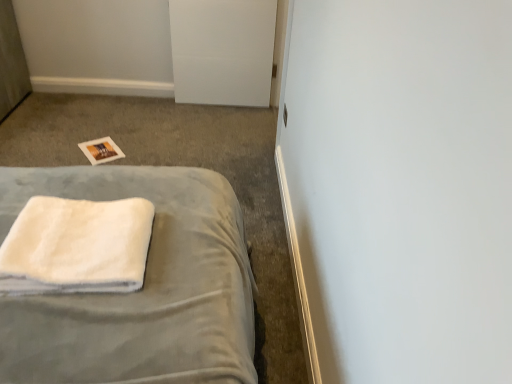
What is the approximate width of white fluffy towel at lower left?

13.58 inches.

The image size is (512, 384). What do you see at coordinates (223, 51) in the screenshot?
I see `white matte door at upper center` at bounding box center [223, 51].

Measure the distance between white matte door at upper center and camera.

They are 9.74 feet apart.

The image size is (512, 384). Find the location of `white fluffy towel at lower left`. white fluffy towel at lower left is located at coordinates point(76,246).

Considering the points (167, 250) and (55, 251), which point is behind, point (167, 250) or point (55, 251)?

Point (167, 250)

From a real-world perspective, is white soft towel at lower left physically located above or below white fluffy towel at lower left?

Clearly, from a real-world perspective, white soft towel at lower left is below white fluffy towel at lower left.

Is the position of white soft towel at lower left less distant than that of white fluffy towel at lower left?

No, white soft towel at lower left is behind white fluffy towel at lower left.

From the image's perspective, between white soft towel at lower left and white fluffy towel at lower left, which one is located above?

white soft towel at lower left is shown above in the image.

Considering the positions of point (227, 92) and point (141, 334), is point (227, 92) closer or farther from the camera than point (141, 334)?

Point (227, 92).

What's the angular difference between white matte door at upper center and white soft towel at lower left's facing directions?

2.91 degrees.

In the scene shown: Relative to white soft towel at lower left, is white matte door at upper center in front or behind?

white matte door at upper center is behind white soft towel at lower left.

From the image's perspective, is white soft towel at lower left above white matte door at upper center?

Incorrect, from the image's perspective, white soft towel at lower left is lower than white matte door at upper center.

Between white soft towel at lower left and white matte door at upper center, which one is positioned behind?

white matte door at upper center is behind.

Is white soft towel at lower left looking in the opposite direction of white matte door at upper center?

No, white matte door at upper center is not at the back of white soft towel at lower left.

You are a GUI agent. You are given a task and a screenshot of the screen. Output one action in this format:
    pyautogui.click(x=<x>, y=<y>)
    Task: Click on the bed that is on the left side of white matte door at upper center
    The height and width of the screenshot is (384, 512).
    Given the screenshot: What is the action you would take?
    pyautogui.click(x=142, y=288)

How distant is white fluffy towel at lower left from white matte door at upper center?

7.19 feet.

Does white fluffy towel at lower left turn towards white matte door at upper center?

Yes, white fluffy towel at lower left is facing white matte door at upper center.

In the image, is white fluffy towel at lower left positioned in front of or behind white matte door at upper center?

In the image, white fluffy towel at lower left appears in front of white matte door at upper center.

Considering the sizes of objects white fluffy towel at lower left and white matte door at upper center in the image provided, who is bigger, white fluffy towel at lower left or white matte door at upper center?

white matte door at upper center is bigger.

Which point is more forward, (x=218, y=47) or (x=52, y=274)?

The point (x=52, y=274) is closer.

From the image's perspective, between white matte door at upper center and white fluffy towel at lower left, which one is located above?

white matte door at upper center.

Is white matte door at upper center facing away from white fluffy towel at lower left?

That's not correct — white matte door at upper center is not looking away from white fluffy towel at lower left.

Is white matte door at upper center not near white fluffy towel at lower left?

Indeed, white matte door at upper center is not near white fluffy towel at lower left.

Considering the positions of objects white fluffy towel at lower left and white soft towel at lower left in the image provided, who is in front, white fluffy towel at lower left or white soft towel at lower left?

Positioned in front is white fluffy towel at lower left.

In the image, there is a white fluffy towel at lower left. Find the location of `bed below it (from a real-world perspective)`. bed below it (from a real-world perspective) is located at coordinates (142, 288).

From the image's perspective, which object appears higher, white fluffy towel at lower left or white soft towel at lower left?

white soft towel at lower left, from the image's perspective.

Considering the sizes of objects white fluffy towel at lower left and white soft towel at lower left in the image provided, who is bigger, white fluffy towel at lower left or white soft towel at lower left?

white soft towel at lower left is bigger.

In the image, there is a white fluffy towel at lower left. At what (x,y) coordinates should I click in order to perform the action: click on bed below it (from a real-world perspective). Please return your answer as a coordinate pair (x, y). The image size is (512, 384). Looking at the image, I should click on (142, 288).

At what (x,y) coordinates should I click in order to perform the action: click on file cabinet behind the white soft towel at lower left. Please return your answer as a coordinate pair (x, y). The image size is (512, 384). Looking at the image, I should click on (223, 51).

When comparing their distances from white matte door at upper center, does white fluffy towel at lower left or white soft towel at lower left seem closer?

white soft towel at lower left is positioned closer to the anchor white matte door at upper center.

Which object lies further to the anchor point white soft towel at lower left, white matte door at upper center or white fluffy towel at lower left?

white matte door at upper center is further to white soft towel at lower left.

Looking at the image, which one is located further to white soft towel at lower left, white fluffy towel at lower left or white matte door at upper center?

The object further to white soft towel at lower left is white matte door at upper center.

Which object lies nearer to the anchor point white matte door at upper center, white soft towel at lower left or white fluffy towel at lower left?

white soft towel at lower left lies closer to white matte door at upper center than the other object.

Looking at the image, which one is located further to white fluffy towel at lower left, white matte door at upper center or white soft towel at lower left?

The object further to white fluffy towel at lower left is white matte door at upper center.

Considering their positions, is white soft towel at lower left positioned closer to white fluffy towel at lower left than white matte door at upper center?

white soft towel at lower left is positioned closer to the anchor white fluffy towel at lower left.

Locate an element on the screen. The width and height of the screenshot is (512, 384). bed between white fluffy towel at lower left and white matte door at upper center in the front-back direction is located at coordinates (142, 288).